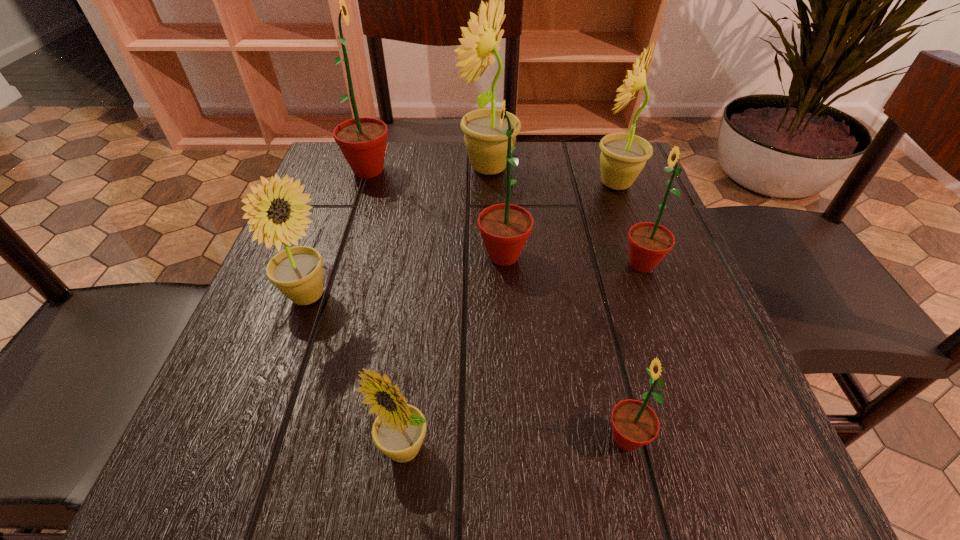
Where is `object at the far right corner`? object at the far right corner is located at coordinates (623, 156).

Locate an element on the screen. object present at the near right corner is located at coordinates (634, 424).

Where is `vacant area at the far edge of the desktop`? vacant area at the far edge of the desktop is located at coordinates point(475,191).

The image size is (960, 540). What are the coordinates of `vacant point at the near edge` in the screenshot? It's located at (552, 460).

The width and height of the screenshot is (960, 540). In the image, there is a desktop. What are the coordinates of `free region at the left edge` in the screenshot? It's located at (312, 220).

Find the location of a particular element. This screenshot has height=540, width=960. vacant space at the right edge of the desktop is located at coordinates (672, 289).

Image resolution: width=960 pixels, height=540 pixels. Find the location of `vacant region at the far left corner of the desktop`. vacant region at the far left corner of the desktop is located at coordinates (391, 143).

Find the location of a particular element. This screenshot has height=540, width=960. vacant space at the near left corner is located at coordinates (261, 503).

Find the location of a particular element. The image size is (960, 540). vacant area at the far right corner of the desktop is located at coordinates (642, 172).

The width and height of the screenshot is (960, 540). In the image, there is a desktop. What are the coordinates of `vacant space at the near right corner` in the screenshot? It's located at (741, 485).